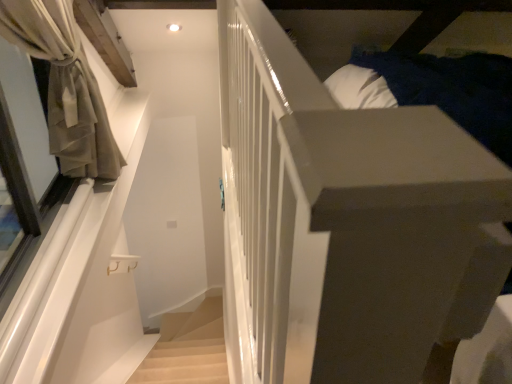
The image size is (512, 384). I want to click on beige sheer curtain at left, so click(x=65, y=86).

What do you see at coordinates (65, 86) in the screenshot?
I see `beige sheer curtain at left` at bounding box center [65, 86].

In order to face beige sheer curtain at left, should I rotate leftwards or rightwards?

To face it directly, rotate left by 26.352 degrees.

Image resolution: width=512 pixels, height=384 pixels. What do you see at coordinates (184, 363) in the screenshot?
I see `light beige carpeted stairs at lower center` at bounding box center [184, 363].

The width and height of the screenshot is (512, 384). What are the coordinates of `light beige carpeted stairs at lower center` in the screenshot? It's located at (184, 363).

Measure the distance between light beige carpeted stairs at lower center and camera.

light beige carpeted stairs at lower center is 7.89 feet from camera.

Identify the location of beige sheer curtain at left. The height and width of the screenshot is (384, 512). (65, 86).

Can you confirm if light beige carpeted stairs at lower center is positioned to the left of beige sheer curtain at left?

In fact, light beige carpeted stairs at lower center is to the right of beige sheer curtain at left.

Is light beige carpeted stairs at lower center positioned behind beige sheer curtain at left?

Yes.

Which is closer to the camera, (165,354) or (97,131)?

The point (97,131) is closer.

From the image's perspective, does light beige carpeted stairs at lower center appear lower than beige sheer curtain at left?

Yes.

Based on the photo, from a real-world perspective, is light beige carpeted stairs at lower center located higher than beige sheer curtain at left?

No, from a real-world perspective, light beige carpeted stairs at lower center is not over beige sheer curtain at left

Which of these two, light beige carpeted stairs at lower center or beige sheer curtain at left, is wider?

Wider between the two is beige sheer curtain at left.

Between light beige carpeted stairs at lower center and beige sheer curtain at left, which one has more height?

Standing taller between the two is beige sheer curtain at left.

Does light beige carpeted stairs at lower center have a larger size compared to beige sheer curtain at left?

No.

Which is correct: light beige carpeted stairs at lower center is inside beige sheer curtain at left, or outside of it?

light beige carpeted stairs at lower center is spatially situated outside beige sheer curtain at left.

Are light beige carpeted stairs at lower center and beige sheer curtain at left making contact?

No, light beige carpeted stairs at lower center is not next to beige sheer curtain at left.

Could you tell me if light beige carpeted stairs at lower center is turned towards beige sheer curtain at left?

No, light beige carpeted stairs at lower center is not oriented towards beige sheer curtain at left.

How much distance is there between light beige carpeted stairs at lower center and beige sheer curtain at left?

light beige carpeted stairs at lower center is 5.20 feet away from beige sheer curtain at left.

This screenshot has height=384, width=512. Identify the location of stairwell that appears below the beige sheer curtain at left (from a real-world perspective). (184, 363).

Between beige sheer curtain at left and light beige carpeted stairs at lower center, which one appears on the left side from the viewer's perspective?

From the viewer's perspective, beige sheer curtain at left appears more on the left side.

Which object is closer to the camera, beige sheer curtain at left or light beige carpeted stairs at lower center?

beige sheer curtain at left is in front.

Which point is more distant from viewer, (x=63, y=110) or (x=222, y=373)?

Positioned behind is point (x=222, y=373).

From the image's perspective, is beige sheer curtain at left over light beige carpeted stairs at lower center?

Yes.

From a real-world perspective, is beige sheer curtain at left under light beige carpeted stairs at lower center?

No, from a real-world perspective, beige sheer curtain at left is not beneath light beige carpeted stairs at lower center.

Is beige sheer curtain at left wider or thinner than light beige carpeted stairs at lower center?

beige sheer curtain at left is wider than light beige carpeted stairs at lower center.

Is beige sheer curtain at left taller than light beige carpeted stairs at lower center?

Correct, beige sheer curtain at left is much taller as light beige carpeted stairs at lower center.

Consider the image. Does beige sheer curtain at left have a larger size compared to light beige carpeted stairs at lower center?

Yes, beige sheer curtain at left is bigger than light beige carpeted stairs at lower center.

Is beige sheer curtain at left completely or partially outside of light beige carpeted stairs at lower center?

Absolutely, beige sheer curtain at left is external to light beige carpeted stairs at lower center.

Is beige sheer curtain at left far from light beige carpeted stairs at lower center?

Yes.

Consider the image. Is light beige carpeted stairs at lower center at the back of beige sheer curtain at left?

That's not correct — beige sheer curtain at left is not looking away from light beige carpeted stairs at lower center.

The width and height of the screenshot is (512, 384). I want to click on stairwell below the beige sheer curtain at left (from the image's perspective), so click(x=184, y=363).

Locate an element on the screen. This screenshot has height=384, width=512. curtain in front of the light beige carpeted stairs at lower center is located at coordinates (65, 86).

You are a GUI agent. You are given a task and a screenshot of the screen. Output one action in this format:
    pyautogui.click(x=<x>, y=<y>)
    Task: Click on the stairwell that is on the right side of beige sheer curtain at left
    This screenshot has height=384, width=512.
    Given the screenshot: What is the action you would take?
    pyautogui.click(x=184, y=363)